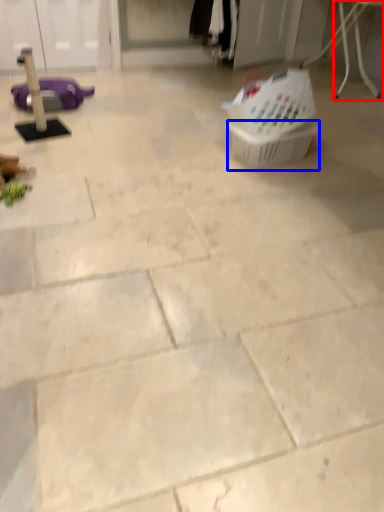
Question: Which point is closer to the camera, furniture (highlighted by a red box) or basket (highlighted by a blue box)?

Choices:
 (A) furniture
 (B) basket

Answer: (B)